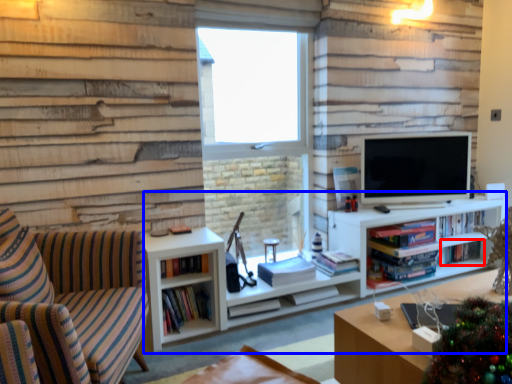
Question: Which point is further to the camera, book (highlighted by a red box) or entertainment center (highlighted by a blue box)?

Choices:
 (A) book
 (B) entertainment center

Answer: (A)